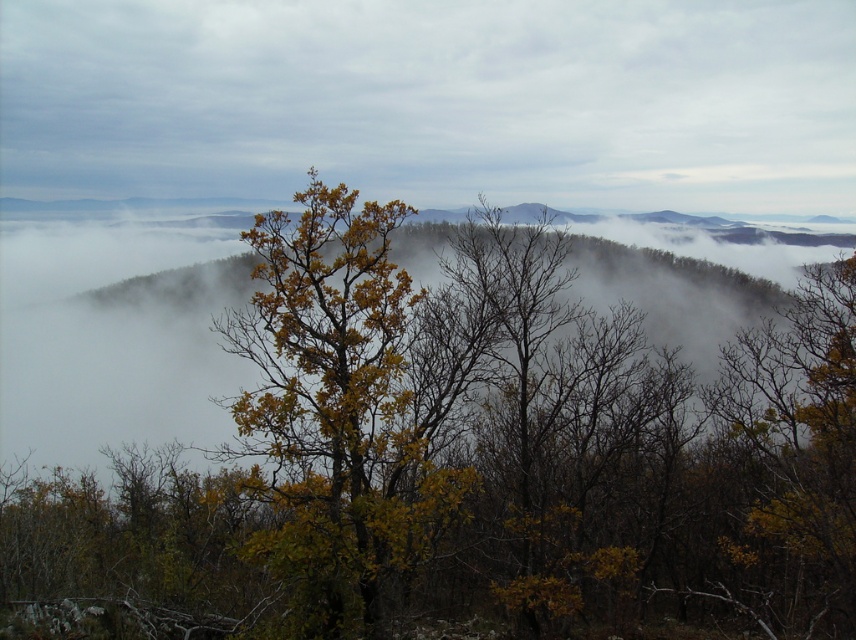
Can you confirm if white fog at upper center is shorter than yellow-green leafy tree at center?

In fact, white fog at upper center may be taller than yellow-green leafy tree at center.

You are a GUI agent. You are given a task and a screenshot of the screen. Output one action in this format:
    pyautogui.click(x=<x>, y=<y>)
    Task: Click on the white fog at upper center
    
    Given the screenshot: What is the action you would take?
    pyautogui.click(x=435, y=100)

Identify the location of white fog at upper center. This screenshot has height=640, width=856. (435, 100).

Is yellow-green leaves at center further to camera compared to white fog at upper center?

That is False.

Can you confirm if yellow-green leaves at center is bigger than white fog at upper center?

No.

The width and height of the screenshot is (856, 640). I want to click on yellow-green leaves at center, so click(x=467, y=458).

Can you confirm if yellow-green leaves at center is wider than yellow-green leafy tree at center?

Yes.

Does point (831, 368) come farther from viewer compared to point (397, 486)?

Yes, it is behind point (397, 486).

Who is more forward, [550,248] or [331,506]?

Point [331,506] is in front.

The height and width of the screenshot is (640, 856). What are the coordinates of `yellow-green leaves at center` in the screenshot? It's located at (467, 458).